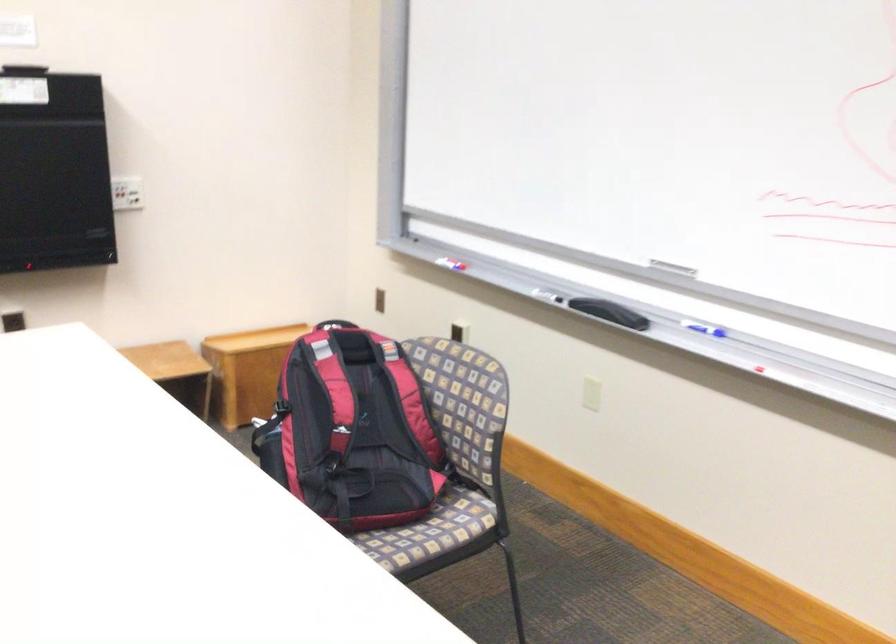
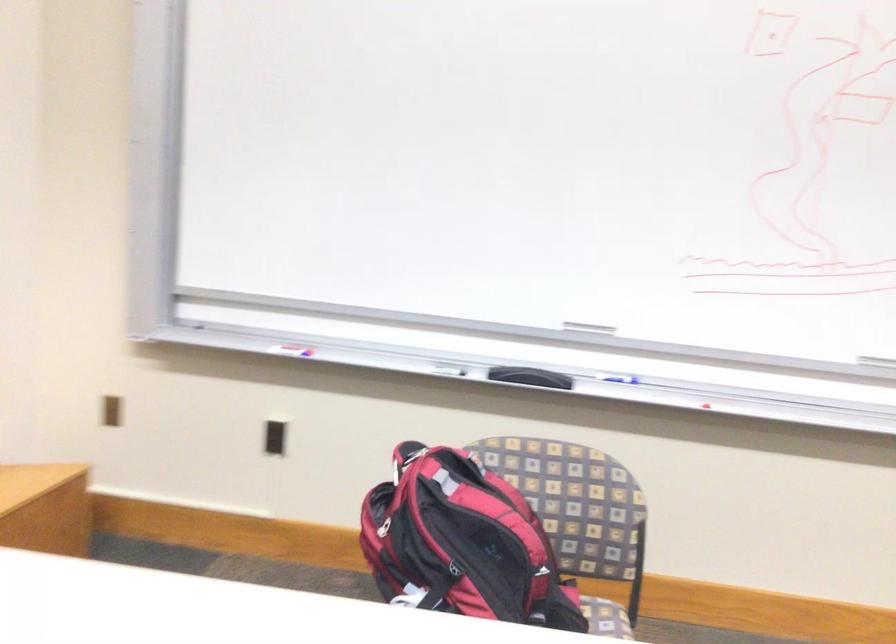
In the second image, find the point that corresponds to [367,290] in the first image.

(112, 410)